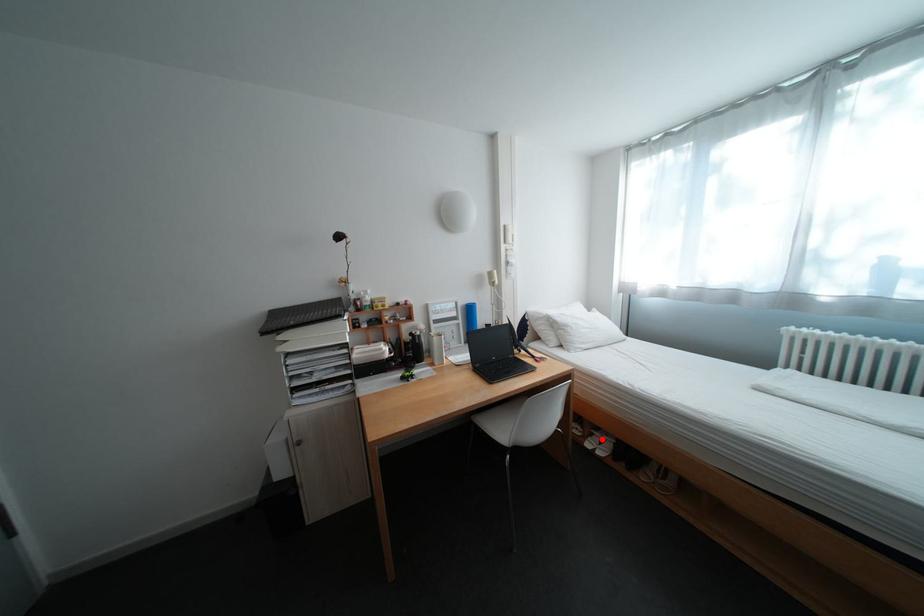
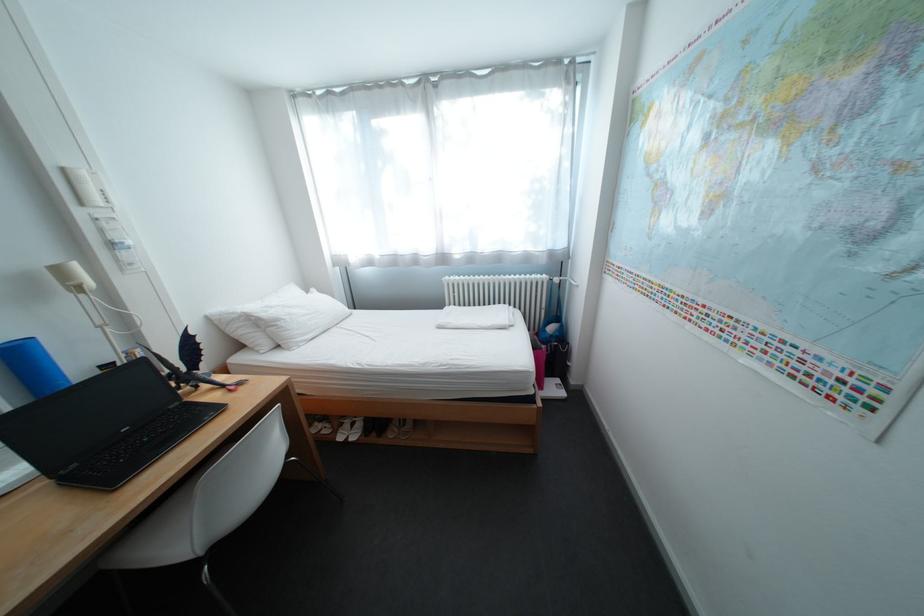
Where in the second image is the point corresponding to the highlighted location from the first image?

(353, 431)